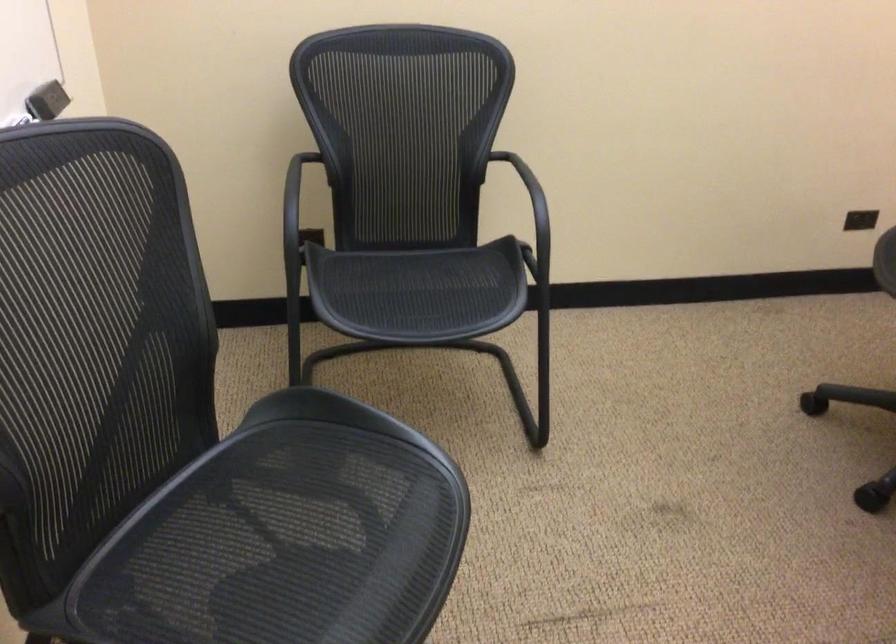
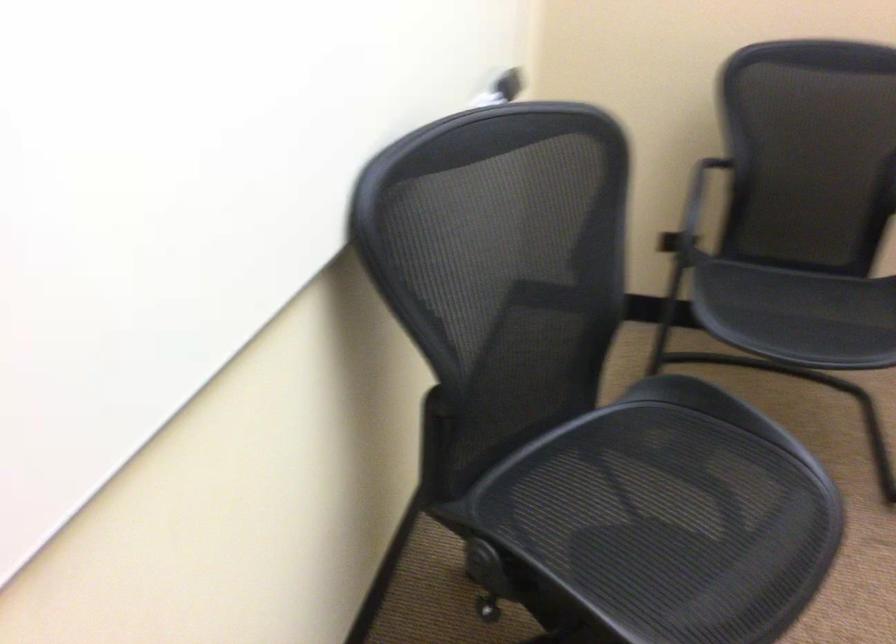
Locate, in the second image, the point that corresponds to point 420,308 in the first image.

(798, 315)